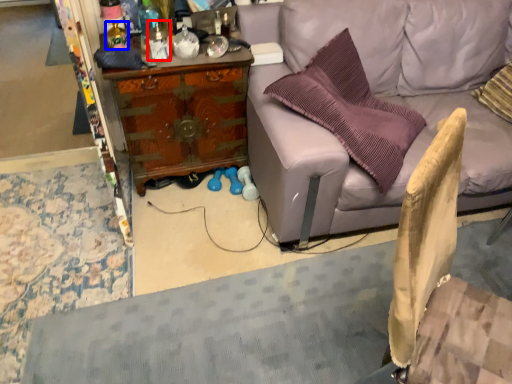
Question: Which object is further to the camera taking this photo, bottle (highlighted by a red box) or bottle (highlighted by a blue box)?

Choices:
 (A) bottle
 (B) bottle

Answer: (B)